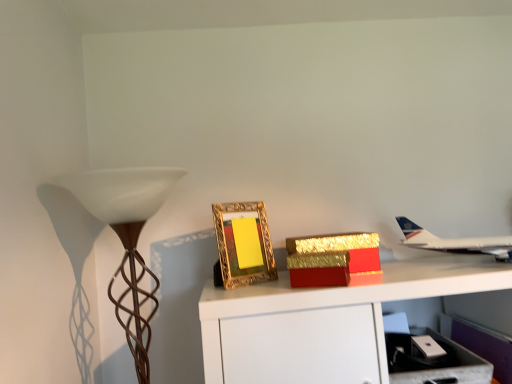
Where is `empty space that is ontop of metallic silver drawer at lower right (from a real-world perspective)`? The image size is (512, 384). empty space that is ontop of metallic silver drawer at lower right (from a real-world perspective) is located at coordinates (423, 344).